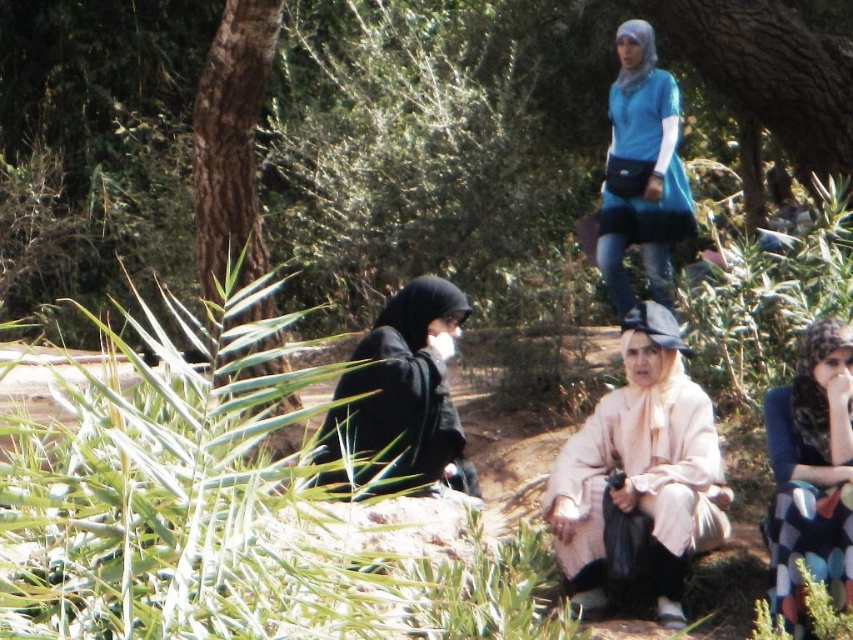
You are a photographer trying to capture a closeup of the light beige fabric coat at center without the brown rough bark tree at left blocking the view. Based on their sizes, can you position yourself in a way that the tree doesn

The light beige fabric coat at center is smaller than the brown rough bark tree at left, so you need to move closer to the coat to ensure the tree doesn

You are standing in the park and see the black matte hijab at center and the blue matte dress at upper center. Which one is positioned to the left?

The black matte hijab at center is positioned to the left of the blue matte dress at upper center.

You are a photographer trying to capture a group photo of the light beige fabric coat at center and the patterned fabric dress at lower right. Your camera has a minimum focus distance of 20 inches. Can you take a clear photo of both objects without moving them?

The light beige fabric coat at center is 22.33 inches away from the patterned fabric dress at lower right. Since the distance between them is greater than the camera minimum focus distance of 20 inches, you can take a clear photo of both objects without moving them.